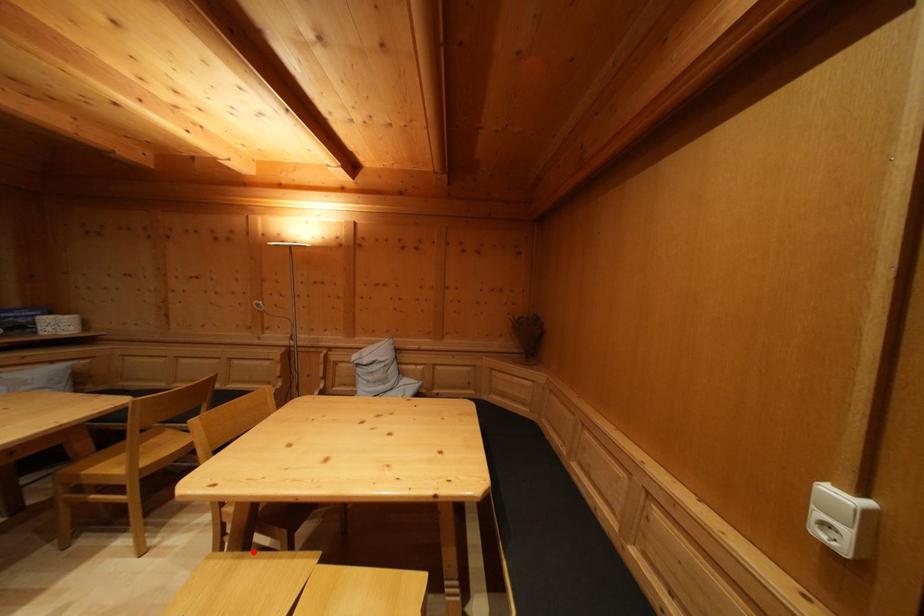
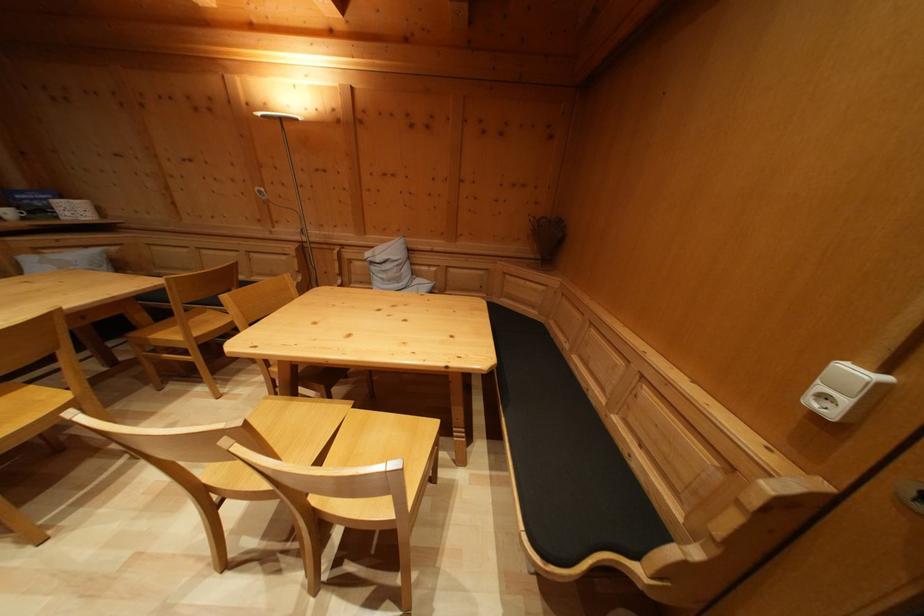
Find the pixel in the second image that matches the highlighted location in the first image.

(300, 400)